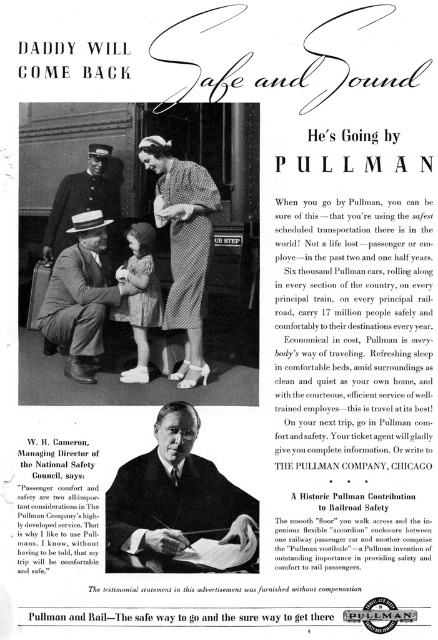
Question: Which object is farther from the camera taking this photo?

Choices:
 (A) smooth black suit at center
 (B) pastel pink dress at center
 (C) uniformed man at center
 (D) checkered fabric dress at center

Answer: (C)

Question: Which object is farther from the camera taking this photo?

Choices:
 (A) smooth black suit at center
 (B) checkered fabric dress at center

Answer: (B)

Question: Is the position of smooth black suit at center more distant than that of checkered fabric dress at center?

Choices:
 (A) no
 (B) yes

Answer: (A)

Question: Which point is closer to the camera taking this photo?

Choices:
 (A) (186, 198)
 (B) (235, 544)
 (C) (144, 300)

Answer: (B)

Question: Is matte black suit at center wider than uniformed man at center?

Choices:
 (A) yes
 (B) no

Answer: (A)

Question: Can you confirm if smooth black suit at center is wider than pastel pink dress at center?

Choices:
 (A) yes
 (B) no

Answer: (A)